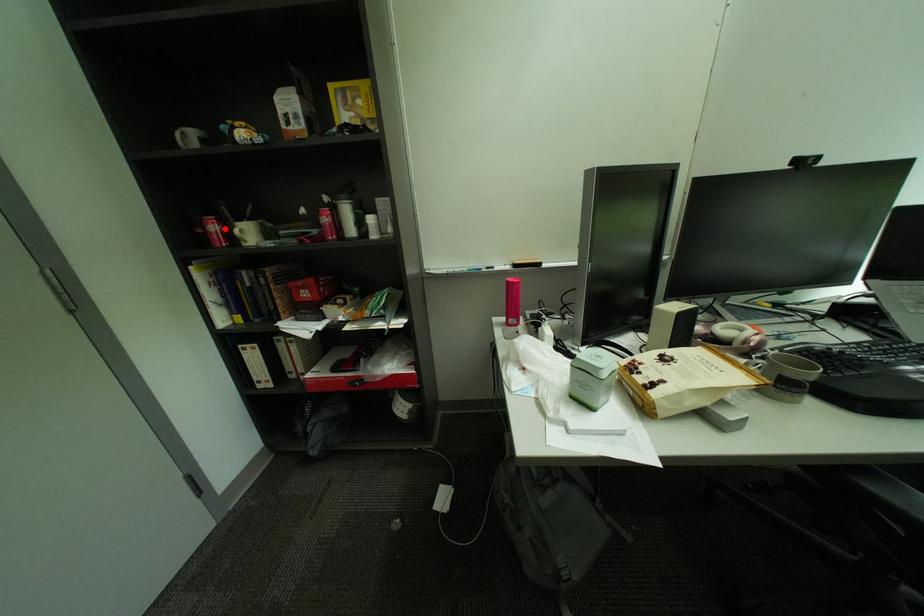
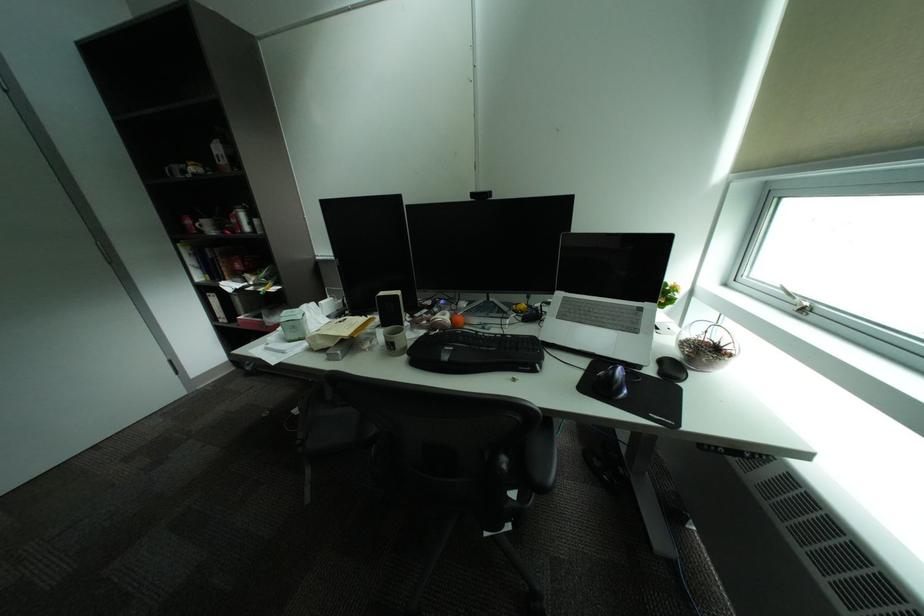
Locate, in the second image, the point that corresponds to the highlighted location in the first image.

(199, 223)